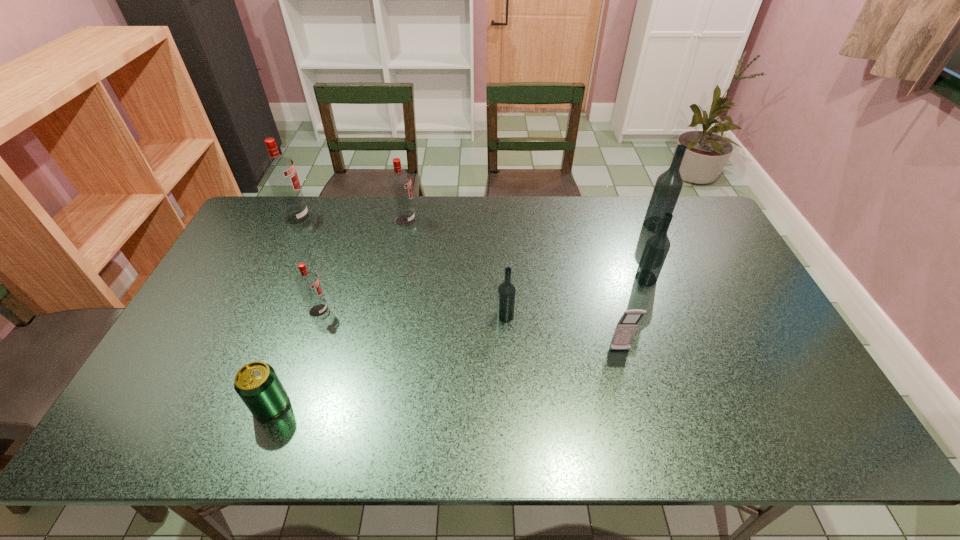
This screenshot has width=960, height=540. What are the coordinates of `the nearest black vodka` in the screenshot? It's located at (506, 297).

Locate an element on the screen. The width and height of the screenshot is (960, 540). the leftmost black vodka is located at coordinates pyautogui.click(x=506, y=297).

This screenshot has width=960, height=540. Find the location of `the sixth object from left to right`. the sixth object from left to right is located at coordinates [626, 327].

Identify the location of the second nearest object. Image resolution: width=960 pixels, height=540 pixels. (626, 327).

Where is `the nearest object`? the nearest object is located at coordinates (257, 384).

Where is `the shortest object`? The height and width of the screenshot is (540, 960). the shortest object is located at coordinates (257, 384).

Locate an element on the screen. The width and height of the screenshot is (960, 540). vacant space situated on the front label of the biggest red vodka is located at coordinates (336, 218).

Locate an element on the screen. The height and width of the screenshot is (540, 960). free region located on the front of the rightmost object is located at coordinates (671, 261).

Find the location of `free space located 0.270m on the front label of the third vodka from left to right`. free space located 0.270m on the front label of the third vodka from left to right is located at coordinates (492, 221).

You are a GUI agent. You are given a task and a screenshot of the screen. Output one action in this format:
    pyautogui.click(x=<x>, y=<y>)
    Task: Click on the free space located on the front of the second object from right to left
    This screenshot has height=540, width=960.
    Given the screenshot: What is the action you would take?
    pyautogui.click(x=658, y=309)